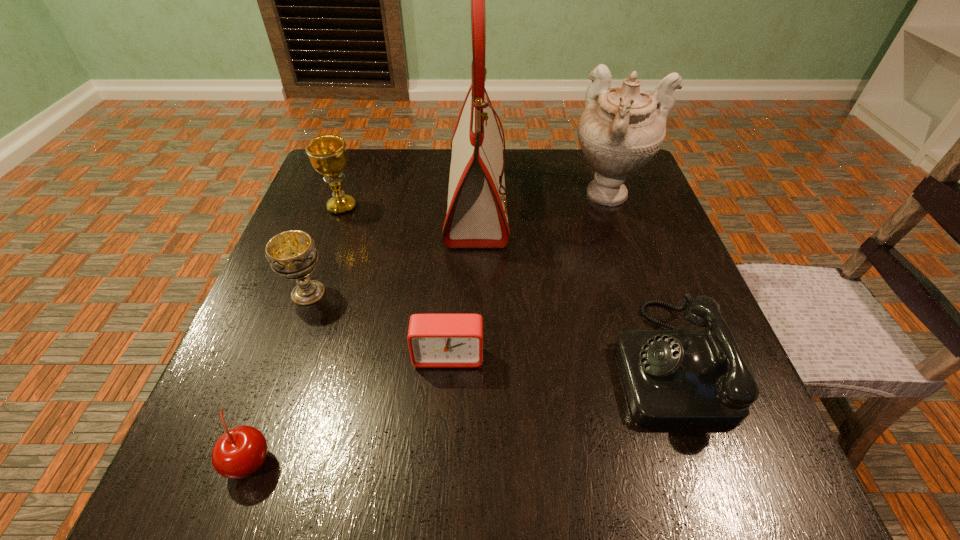
Image resolution: width=960 pixels, height=540 pixels. Find the location of `object present at the near edge`. object present at the near edge is located at coordinates (239, 452).

I want to click on cherry situated at the left edge, so click(x=239, y=452).

This screenshot has width=960, height=540. What are the coordinates of `urn located at the right edge` in the screenshot? It's located at (621, 129).

Where is `telephone that is at the right edge`? telephone that is at the right edge is located at coordinates (672, 378).

I want to click on object present at the far left corner, so click(x=327, y=153).

I want to click on object situated at the near left corner, so pos(239,452).

Image resolution: width=960 pixels, height=540 pixels. I want to click on object that is at the far right corner, so click(x=621, y=129).

Identify the location of free spot at the far edge of the desktop. (564, 202).

This screenshot has height=540, width=960. In the image, there is a desktop. Find the location of `free space at the left edge`. free space at the left edge is located at coordinates (343, 244).

Locate an element on the screen. free space at the far left corner of the desktop is located at coordinates (386, 155).